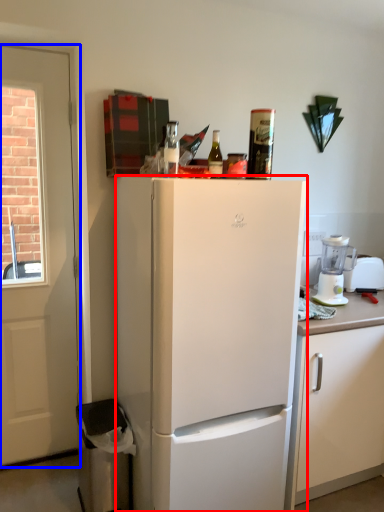
Question: Among these objects, which one is farthest to the camera, refrigerator (highlighted by a red box) or door (highlighted by a blue box)?

Choices:
 (A) refrigerator
 (B) door

Answer: (B)